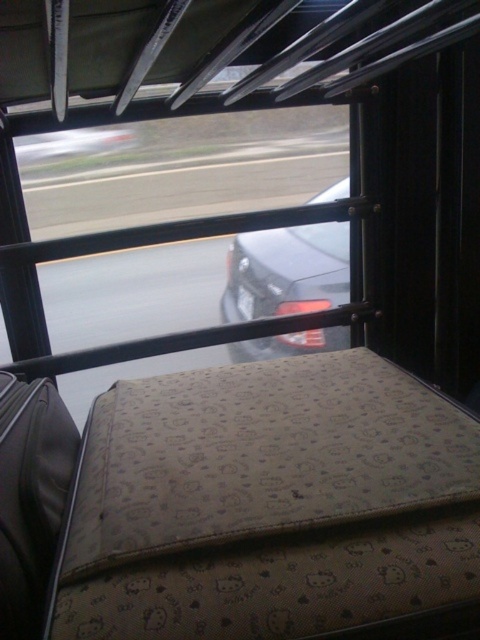
You are a passenger in the vehicle and want to place your leather suitcase at lower left next to the metallic silver car at left. Since both are visible through the window, can you determine which one is physically closer to you?

The leather suitcase at lower left is bigger than metallic silver car at left, so it is closer to you.

You are a passenger on a moving train and see a beige fabric suitcase at center and a leather suitcase at lower left. Which one is positioned more to the right side of the train compartment?

The beige fabric suitcase at center is positioned more to the right side of the train compartment than the leather suitcase at lower left.